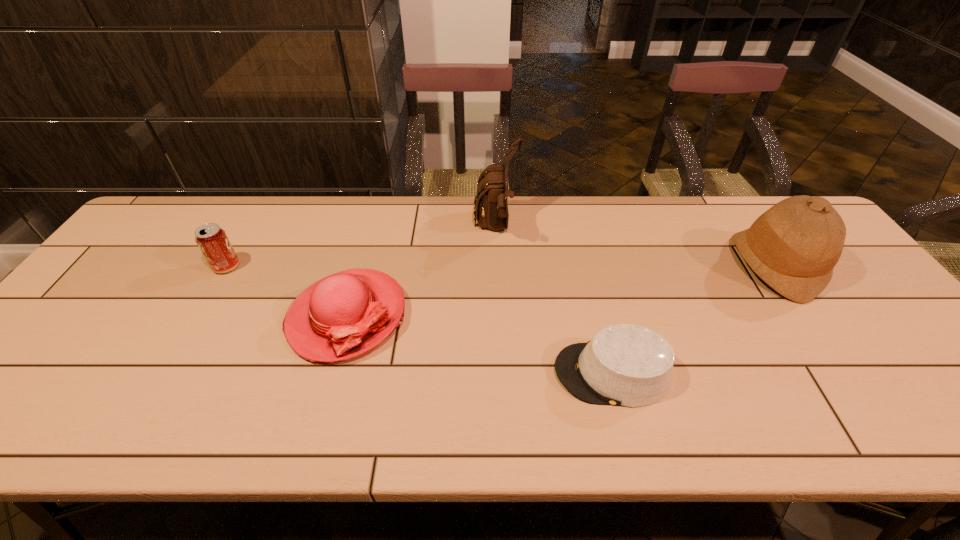
Find the location of a particular element. The width and height of the screenshot is (960, 540). free space located on the front-facing side of the third object from left to right is located at coordinates (396, 228).

Where is `vacant space located 0.100m on the front-facing side of the rightmost object`? vacant space located 0.100m on the front-facing side of the rightmost object is located at coordinates (698, 265).

The image size is (960, 540). In order to click on vacant space located on the front-facing side of the rightmost object in this screenshot , I will do `click(606, 265)`.

I want to click on vacant space situated on the front-facing side of the rightmost object, so click(616, 265).

Where is `vacant position located 0.090m on the right of the leftmost object`? Image resolution: width=960 pixels, height=540 pixels. vacant position located 0.090m on the right of the leftmost object is located at coordinates (272, 266).

Where is `free location located at the front of the second shortest hat with a bow`? free location located at the front of the second shortest hat with a bow is located at coordinates (320, 416).

Image resolution: width=960 pixels, height=540 pixels. I want to click on vacant space situated on the front-facing side of the shortest object, so click(429, 373).

Locate an element on the screen. free location located 0.400m on the front-facing side of the shortest object is located at coordinates tap(376, 373).

Where is `vacant space situated 0.130m on the front-facing side of the shortest object`? The height and width of the screenshot is (540, 960). vacant space situated 0.130m on the front-facing side of the shortest object is located at coordinates (496, 373).

You are a GUI agent. You are given a task and a screenshot of the screen. Output one action in this format:
    pyautogui.click(x=<x>, y=<y>)
    Task: Click on the shoulder bag that is positioned at the far edge
    The image size is (960, 540).
    Given the screenshot: What is the action you would take?
    (490, 205)